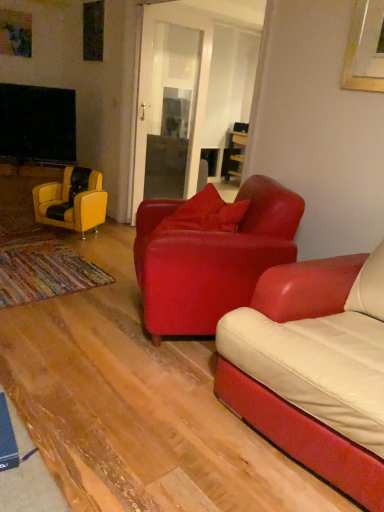
Question: From the image's perspective, is satin red armchair at center, the first chair when ordered from right to left, below leather yellow armchair at left, which is the 1th chair in back-to-front order?

Choices:
 (A) yes
 (B) no

Answer: (A)

Question: Is satin red armchair at center, which is the first chair in front-to-back order, facing towards leather yellow armchair at left, which is the second chair from front to back?

Choices:
 (A) no
 (B) yes

Answer: (A)

Question: From a real-world perspective, is satin red armchair at center, arranged as the second chair when viewed from the left, positioned over leather yellow armchair at left, which is the second chair from front to back, based on gravity?

Choices:
 (A) yes
 (B) no

Answer: (A)

Question: Is satin red armchair at center, acting as the 2th chair starting from the back, to the left of leather yellow armchair at left, which is the 1th chair in back-to-front order, from the viewer's perspective?

Choices:
 (A) no
 (B) yes

Answer: (A)

Question: Does satin red armchair at center, acting as the 2th chair starting from the back, have a larger size compared to leather yellow armchair at left, which is the second chair from front to back?

Choices:
 (A) no
 (B) yes

Answer: (B)

Question: Considering the relative sizes of satin red armchair at center, acting as the 2th chair starting from the back, and leather yellow armchair at left, arranged as the 2th chair when viewed from the right, in the image provided, is satin red armchair at center, acting as the 2th chair starting from the back, wider than leather yellow armchair at left, arranged as the 2th chair when viewed from the right,?

Choices:
 (A) yes
 (B) no

Answer: (A)

Question: Considering the relative sizes of leather yellow armchair at left, which is the first chair from left to right, and satin red armchair at center, acting as the 2th chair starting from the back, in the image provided, is leather yellow armchair at left, which is the first chair from left to right, bigger than satin red armchair at center, acting as the 2th chair starting from the back,?

Choices:
 (A) no
 (B) yes

Answer: (A)

Question: Are leather yellow armchair at left, which is the second chair from front to back, and satin red armchair at center, arranged as the second chair when viewed from the left, located far from each other?

Choices:
 (A) yes
 (B) no

Answer: (A)

Question: From the image's perspective, does leather yellow armchair at left, which is the 1th chair in back-to-front order, appear lower than satin red armchair at center, the first chair when ordered from right to left?

Choices:
 (A) yes
 (B) no

Answer: (B)

Question: Is leather yellow armchair at left, which is the 1th chair in back-to-front order, located outside satin red armchair at center, acting as the 2th chair starting from the back?

Choices:
 (A) no
 (B) yes

Answer: (B)

Question: From a real-world perspective, is leather yellow armchair at left, which is the 1th chair in back-to-front order, located higher than satin red armchair at center, arranged as the second chair when viewed from the left?

Choices:
 (A) yes
 (B) no

Answer: (B)

Question: Is leather yellow armchair at left, which is the 1th chair in back-to-front order, to the left of satin red armchair at center, acting as the 2th chair starting from the back, from the viewer's perspective?

Choices:
 (A) no
 (B) yes

Answer: (B)

Question: Considering the positions of point (64, 179) and point (160, 270), is point (64, 179) closer or farther from the camera than point (160, 270)?

Choices:
 (A) closer
 (B) farther

Answer: (B)